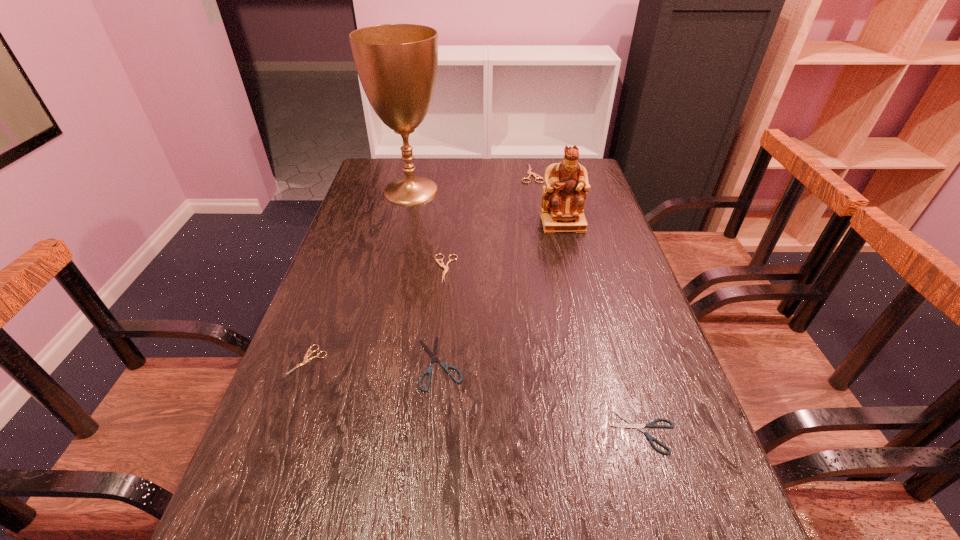
The image size is (960, 540). Find the location of `trophy cup located in the far edge section of the desktop`. trophy cup located in the far edge section of the desktop is located at coordinates (397, 64).

At what (x,y) coordinates should I click in order to perform the action: click on shears that is positioned at the far edge. Please return your answer as a coordinate pair (x, y). The width and height of the screenshot is (960, 540). Looking at the image, I should click on (530, 173).

The image size is (960, 540). Identify the location of trophy cup present at the left edge. (397, 64).

The width and height of the screenshot is (960, 540). In order to click on shears that is at the left edge in this screenshot , I will do `click(307, 355)`.

Where is `figurine positioned at the right edge`? figurine positioned at the right edge is located at coordinates (566, 183).

This screenshot has height=540, width=960. Find the location of `shears at the right edge`. shears at the right edge is located at coordinates (633, 425).

Locate an element on the screen. This screenshot has width=960, height=540. object that is at the far left corner is located at coordinates pos(397,64).

This screenshot has height=540, width=960. I want to click on free location at the far edge, so click(x=467, y=181).

Locate an element on the screen. The height and width of the screenshot is (540, 960). free spot at the left edge of the desktop is located at coordinates (310, 319).

Locate an element on the screen. free space at the right edge of the desktop is located at coordinates (590, 253).